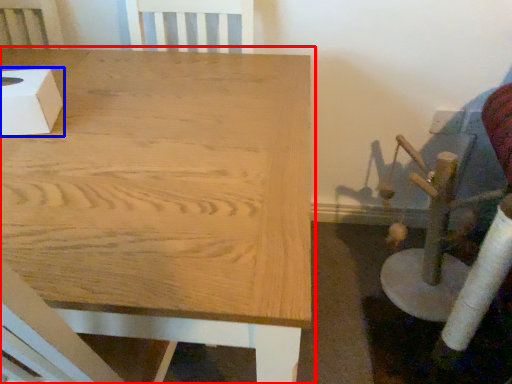
Question: Which object appears farthest to the camera in this image, table (highlighted by a red box) or box (highlighted by a blue box)?

Choices:
 (A) table
 (B) box

Answer: (B)